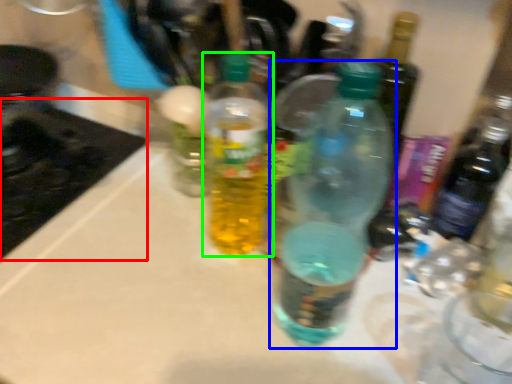
Question: Based on their relative distances, which object is nearer to appliance (highlighted by a red box)? Choose from bottle (highlighted by a blue box) and bottle (highlighted by a green box).

Choices:
 (A) bottle
 (B) bottle

Answer: (B)